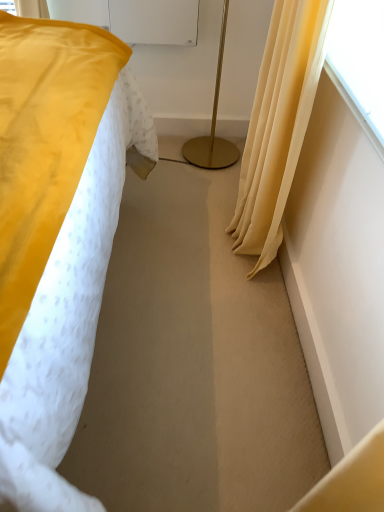
Find the location of a particular element. The height and width of the screenshot is (512, 384). vacant space situated on the left part of matte yellow curtain at right is located at coordinates (176, 238).